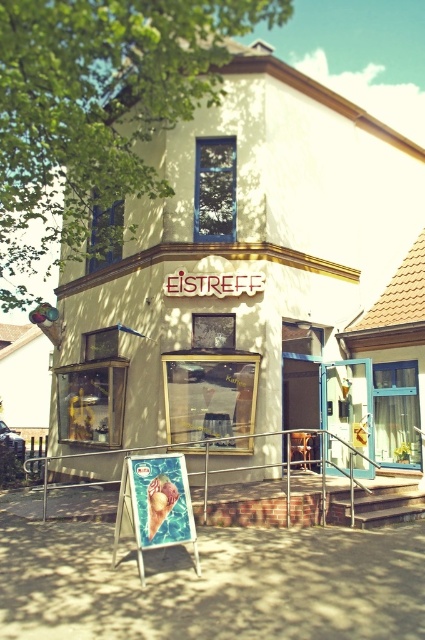
Question: Does green leafy tree at upper left appear over metallic silver rail at center?

Choices:
 (A) no
 (B) yes

Answer: (B)

Question: Does white matte storefront at center have a greater width compared to metallic ice cream cone at center?

Choices:
 (A) no
 (B) yes

Answer: (B)

Question: Which of the following is the farthest from the observer?

Choices:
 (A) metallic silver rail at center
 (B) metallic ice cream cone at center
 (C) green leafy tree at upper left
 (D) white matte storefront at center

Answer: (D)

Question: Which point is closer to the camera taking this photo?

Choices:
 (A) (274, 13)
 (B) (192, 474)
 (C) (124, 472)

Answer: (C)

Question: Among these points, which one is nearest to the camera?

Choices:
 (A) (371, 445)
 (B) (31, 461)

Answer: (A)

Question: Does white matte storefront at center appear under metallic ice cream cone at center?

Choices:
 (A) no
 (B) yes

Answer: (A)